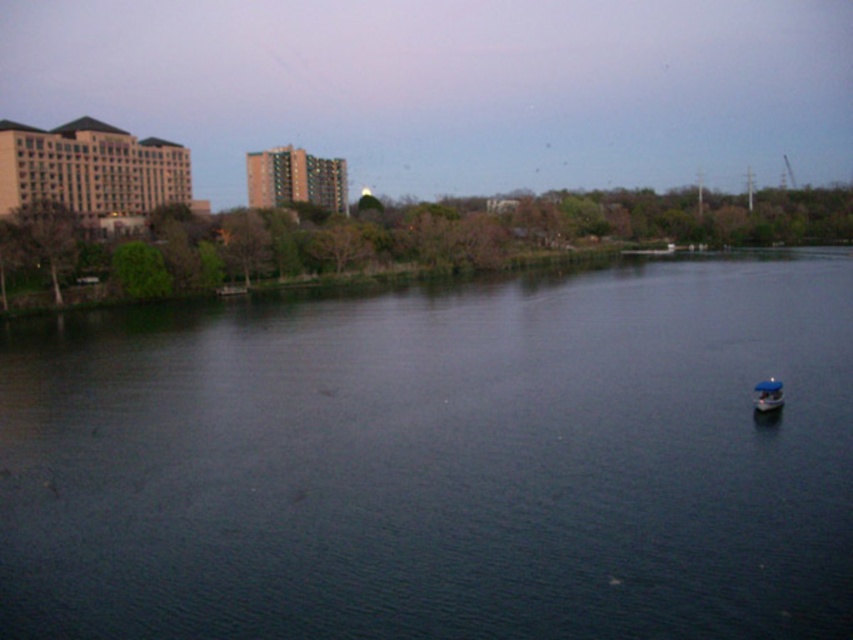
You are standing on the riverside and want to board the blue matte boat at lower right. Is the dark blue water at center in your way?

The dark blue water at center is positioned over the blue matte boat at lower right, so the water is covering the boat and blocking your path. You cannot board the boat directly from the riverside as the water is in the way.

You are standing at the riverside and see two points marked in the scene. Which point is closer to you, point (39, 592) or point (764, 408)?

Result: Point (39, 592) is in front of point (764, 408), so it is closer to you.